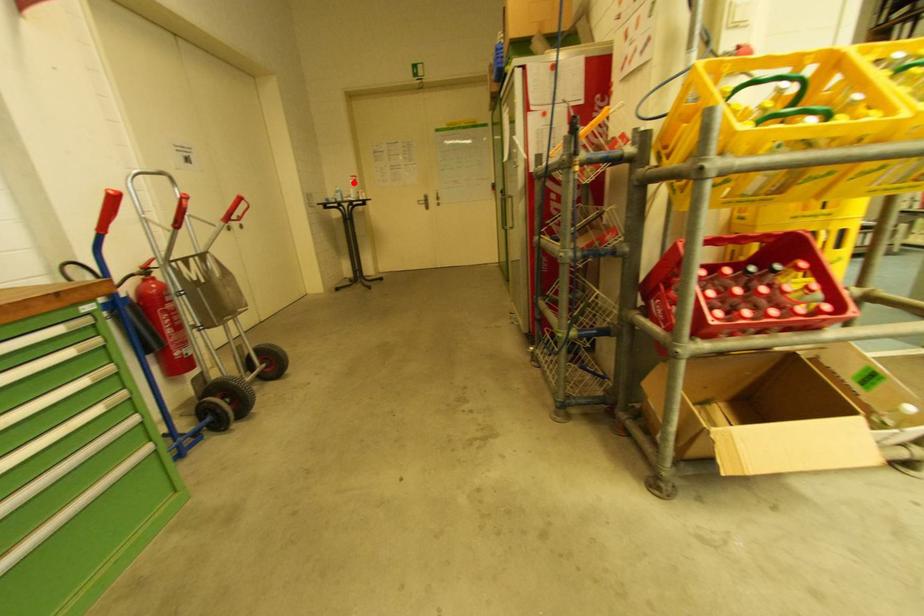
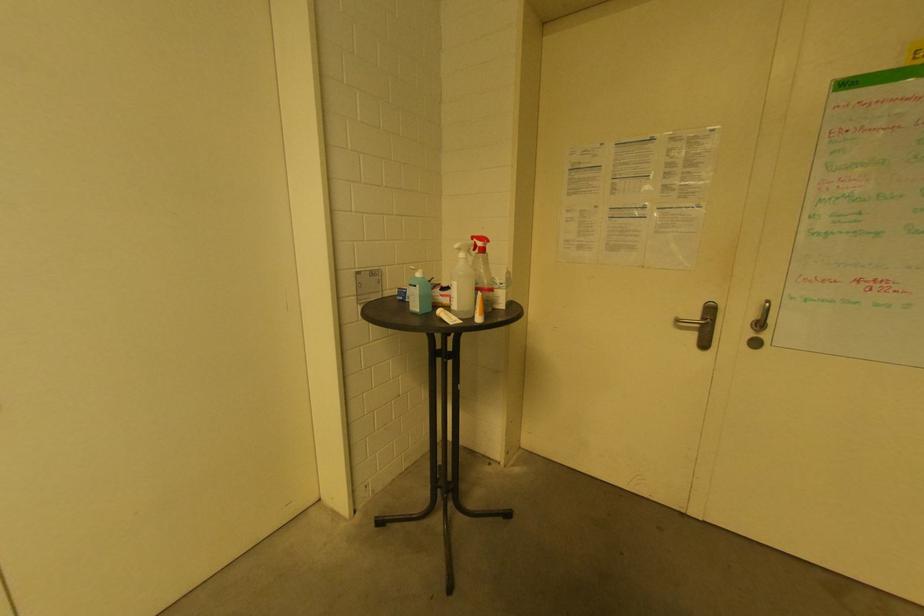
Question: I am providing you with two images of the same scene from different viewpoints. A red point is marked on the first image. At the location where the point appears in image 1, is it still visible in image 2?

Choices:
 (A) Yes
 (B) No

Answer: (A)